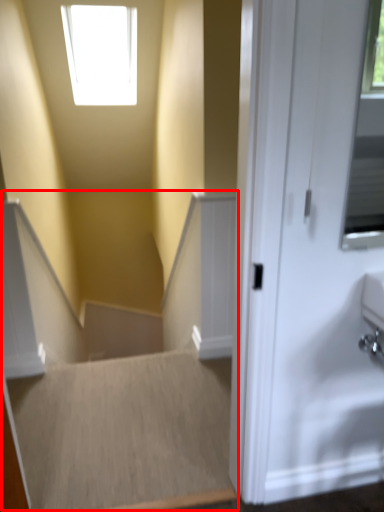
Question: From the image's perspective, where is stairwell (annotated by the red box) located in relation to stairwell in the image?

Choices:
 (A) above
 (B) below

Answer: (A)